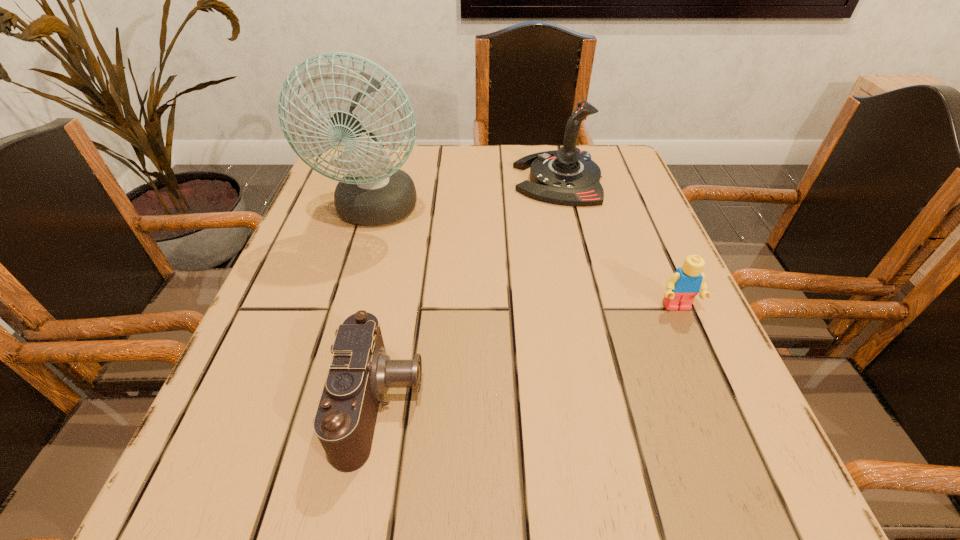
This screenshot has width=960, height=540. I want to click on fan, so click(x=373, y=192).

You are a GUI agent. You are given a task and a screenshot of the screen. Output one action in this format:
    pyautogui.click(x=<x>, y=<y>)
    Task: Click on the second tallest object
    
    Given the screenshot: What is the action you would take?
    pyautogui.click(x=567, y=176)

I want to click on joystick, so click(567, 176).

You are a GUI agent. You are given a task and a screenshot of the screen. Output one action in this format:
    pyautogui.click(x=<x>, y=<y>)
    Task: Click on the Lego
    This screenshot has height=540, width=960.
    Given the screenshot: What is the action you would take?
    pyautogui.click(x=682, y=286)

Where is `the rightmost object`? This screenshot has width=960, height=540. the rightmost object is located at coordinates (682, 286).

Where is `camera`? camera is located at coordinates (360, 372).

This screenshot has height=540, width=960. Find the location of `vacant space located in front of the fan where the airflow is directed`. vacant space located in front of the fan where the airflow is directed is located at coordinates (344, 322).

Locate an element on the screen. This screenshot has height=540, width=960. vacant space situated 0.120m on the handle side of the third object from left to right is located at coordinates (464, 179).

Locate an element on the screen. free space located on the handle side of the third object from left to right is located at coordinates (464, 179).

Identify the location of vacant space located on the handle side of the third object from left to right. (489, 179).